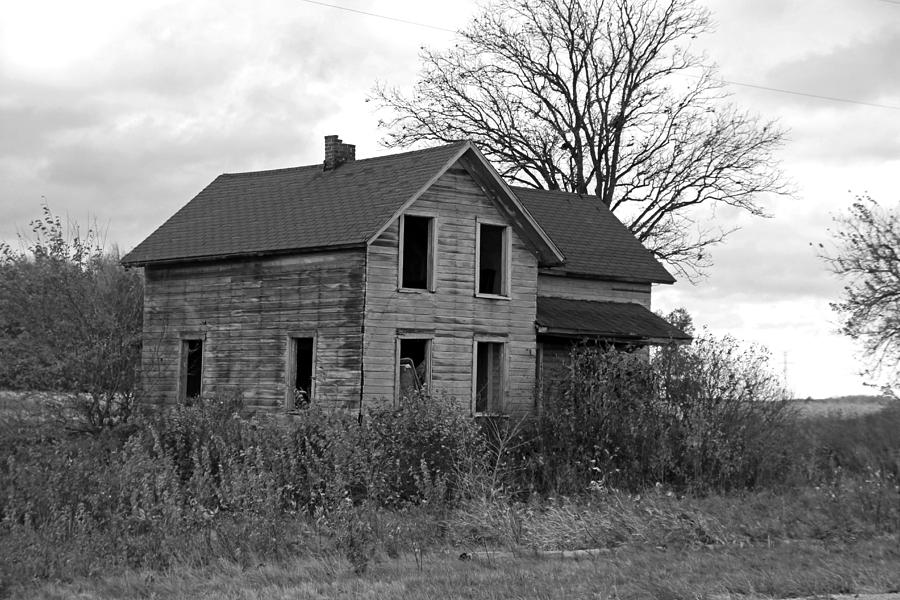
Locate an element on the screen. Image resolution: width=900 pixels, height=600 pixels. window openings is located at coordinates (424, 344), (482, 366), (492, 269), (426, 271).